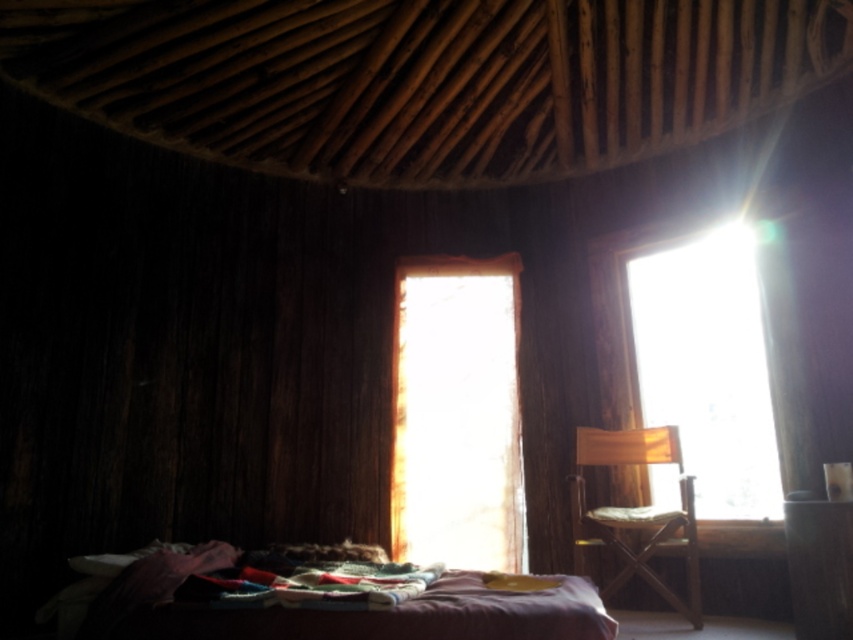
You are standing inside the rustic wooden structure and want to know how far you are from the point marked at coordinates (410, 400). Can you determine the distance?

The point marked at coordinates (410, 400) is 4.74 meters away from you.

You are standing in the rustic wooden structure and want to sit in the purple fabric bed at lower center. To avoid direct sunlight, should you position yourself facing away from the transparent glass window at upper right?

The transparent glass window at upper right is located above the purple fabric bed at lower center, so facing away from the window would position you away from the direct sunlight coming through the window.